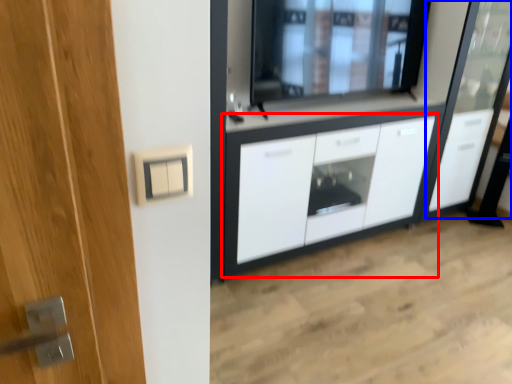
Question: Which object is closer to the camera taking this photo, cabinetry (highlighted by a red box) or screen door (highlighted by a blue box)?

Choices:
 (A) cabinetry
 (B) screen door

Answer: (A)